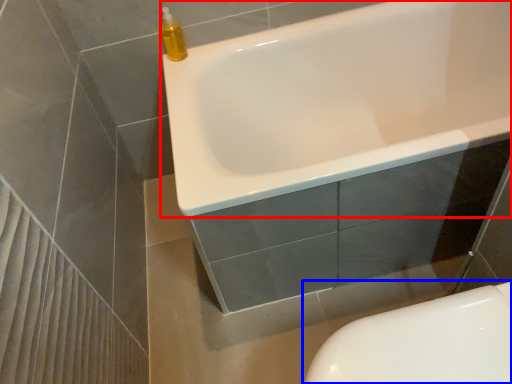
Question: Which point is closer to the camera, bathtub (highlighted by a red box) or toilet (highlighted by a blue box)?

Choices:
 (A) bathtub
 (B) toilet

Answer: (B)